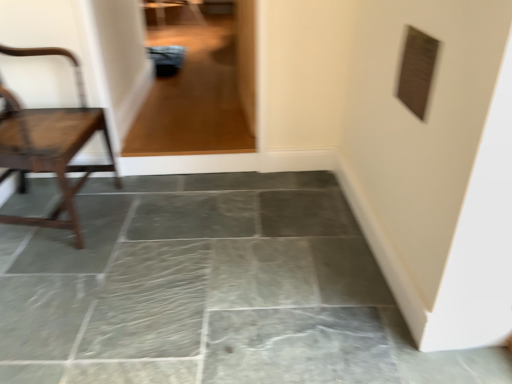
Question: Is gray stone floor at center not close to transparent glass door at upper center?

Choices:
 (A) yes
 (B) no

Answer: (A)

Question: Is gray stone floor at center positioned beyond the bounds of transparent glass door at upper center?

Choices:
 (A) no
 (B) yes

Answer: (B)

Question: Is transparent glass door at upper center a part of gray stone floor at center?

Choices:
 (A) no
 (B) yes

Answer: (A)

Question: Is gray stone floor at center taller than transparent glass door at upper center?

Choices:
 (A) no
 (B) yes

Answer: (A)

Question: Is gray stone floor at center bigger than transparent glass door at upper center?

Choices:
 (A) yes
 (B) no

Answer: (A)

Question: Does gray stone floor at center have a smaller size compared to transparent glass door at upper center?

Choices:
 (A) no
 (B) yes

Answer: (A)

Question: Could you tell me if wooden chair at left is facing transparent glass door at upper center?

Choices:
 (A) no
 (B) yes

Answer: (A)

Question: Is there a large distance between wooden chair at left and transparent glass door at upper center?

Choices:
 (A) yes
 (B) no

Answer: (B)

Question: Is the position of wooden chair at left more distant than that of transparent glass door at upper center?

Choices:
 (A) yes
 (B) no

Answer: (B)

Question: Would you say wooden chair at left is outside transparent glass door at upper center?

Choices:
 (A) no
 (B) yes

Answer: (B)

Question: From a real-world perspective, is wooden chair at left positioned over transparent glass door at upper center based on gravity?

Choices:
 (A) no
 (B) yes

Answer: (A)

Question: Is wooden chair at left touching transparent glass door at upper center?

Choices:
 (A) yes
 (B) no

Answer: (B)

Question: Can you confirm if transparent glass door at upper center is bigger than wooden chair at left?

Choices:
 (A) yes
 (B) no

Answer: (B)